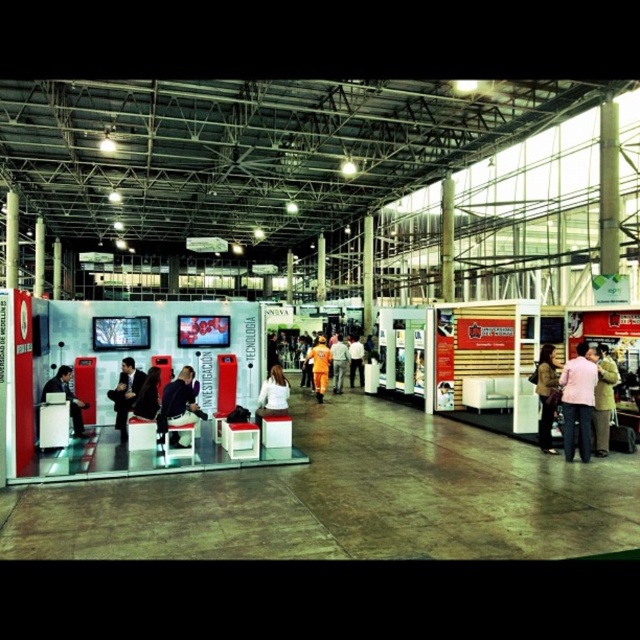
Can you confirm if light pink fabric coat at right is smaller than orange fabric pants at center?

Yes, light pink fabric coat at right is smaller than orange fabric pants at center.

Does light pink fabric coat at right have a greater width compared to orange fabric pants at center?

Incorrect, light pink fabric coat at right's width does not surpass orange fabric pants at center's.

Identify the location of light pink fabric coat at right. The width and height of the screenshot is (640, 640). (602, 397).

Does point (611, 380) come in front of point (74, 406)?

Yes.

Does light pink fabric coat at right have a lesser width compared to matte black laptop at left?

No, light pink fabric coat at right is not thinner than matte black laptop at left.

Between point (602, 392) and point (80, 412), which one is positioned in front?

Point (602, 392)

This screenshot has width=640, height=640. What are the coordinates of `light pink fabric coat at right` in the screenshot? It's located at (602, 397).

Between white matte shirt at center and matte black laptop at left, which one is positioned lower?

Positioned lower is matte black laptop at left.

How much distance is there between white matte shirt at center and matte black laptop at left?

white matte shirt at center and matte black laptop at left are 3.54 meters apart from each other.

Does point (282, 396) come closer to viewer compared to point (65, 371)?

That is True.

Image resolution: width=640 pixels, height=640 pixels. What are the coordinates of `white matte shirt at center` in the screenshot? It's located at (273, 396).